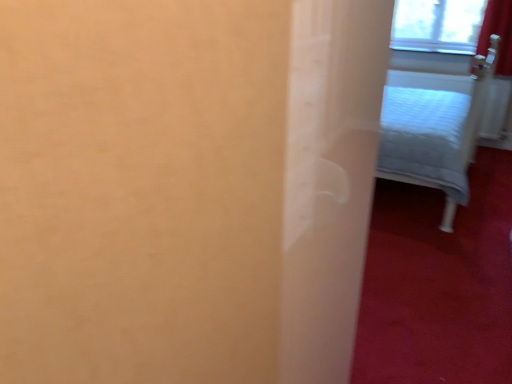
Question: Is transparent glass window at upper right inside or outside of light gray fabric bed at upper right?

Choices:
 (A) outside
 (B) inside

Answer: (A)

Question: From the image's perspective, is transparent glass window at upper right above or below light gray fabric bed at upper right?

Choices:
 (A) above
 (B) below

Answer: (A)

Question: Considering the positions of transparent glass window at upper right and light gray fabric bed at upper right in the image, is transparent glass window at upper right wider or thinner than light gray fabric bed at upper right?

Choices:
 (A) wide
 (B) thin

Answer: (B)

Question: Does point (459, 119) appear closer or farther from the camera than point (433, 39)?

Choices:
 (A) closer
 (B) farther

Answer: (A)

Question: In the image, is light gray fabric bed at upper right positioned in front of or behind transparent glass window at upper right?

Choices:
 (A) behind
 (B) front

Answer: (B)

Question: Which is correct: light gray fabric bed at upper right is inside transparent glass window at upper right, or outside of it?

Choices:
 (A) outside
 (B) inside

Answer: (A)

Question: From the image's perspective, relative to transparent glass window at upper right, is light gray fabric bed at upper right above or below?

Choices:
 (A) above
 (B) below

Answer: (B)